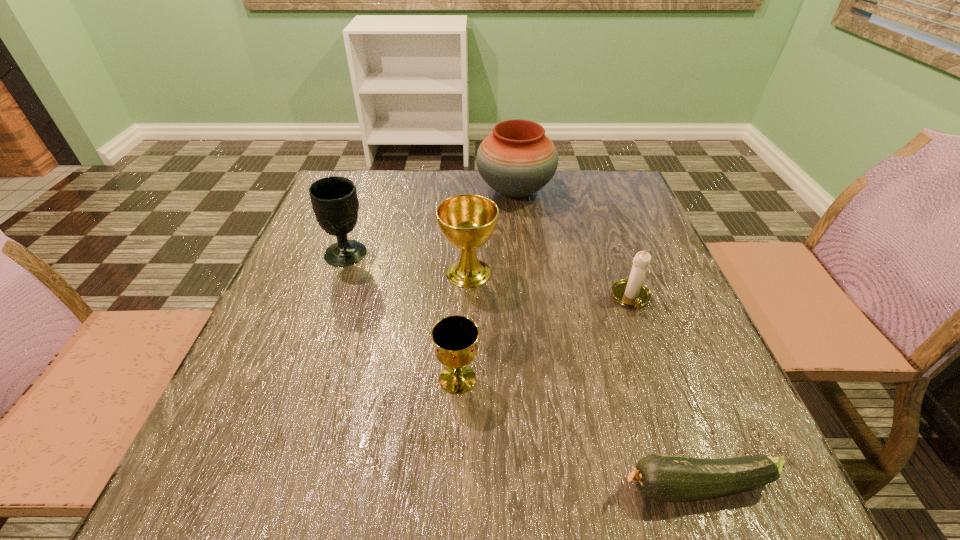
Identify the location of free space between the farthest object and the zucchini. (607, 339).

Locate an element on the screen. vacant area that lies between the nearest object and the leftmost object is located at coordinates (522, 370).

Where is `free space between the shortest chalice and the candle holder`? The image size is (960, 540). free space between the shortest chalice and the candle holder is located at coordinates [544, 339].

Point out which object is positioned as the fourth nearest to the nearest chalice. Please provide its 2D coordinates. Your answer should be formatted as a tuple, i.e. [(x, y)], where the tuple contains the x and y coordinates of a point satisfying the conditions above.

[(334, 199)]

At what (x,y) coordinates should I click in order to perform the action: click on object that is the fourth closest to the nearest object. Please return your answer as a coordinate pair (x, y). The image size is (960, 540). Looking at the image, I should click on (334, 199).

Point out which chalice is positioned as the second nearest to the leftmost chalice. Please provide its 2D coordinates. Your answer should be formatted as a tuple, i.e. [(x, y)], where the tuple contains the x and y coordinates of a point satisfying the conditions above.

[(455, 337)]

Locate which chalice is the second closest to the leftmost chalice. Please provide its 2D coordinates. Your answer should be formatted as a tuple, i.e. [(x, y)], where the tuple contains the x and y coordinates of a point satisfying the conditions above.

[(455, 337)]

Find the location of a particular element. The image size is (960, 540). free location that satisfies the following two spatial constraints: 1. on the handle side of the candle holder; 2. at the blossom end of the zucchini is located at coordinates (699, 487).